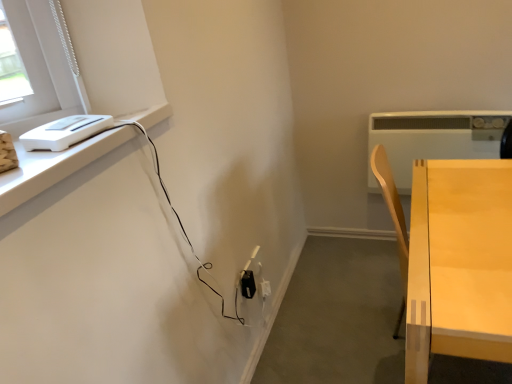
At what (x,y) coordinates should I click in order to perform the action: click on black plastic electric outlet at lower center. Please return your answer as a coordinate pair (x, y). The width and height of the screenshot is (512, 384). Looking at the image, I should click on (248, 284).

Locate an element on the screen. white plastic heater at upper right, the 1th appliance in the back-to-front sequence is located at coordinates (433, 138).

Where is `black plastic electric outlet at lower center`? The image size is (512, 384). black plastic electric outlet at lower center is located at coordinates (248, 284).

Is white plastic heater at upper right, the 1th appliance in the back-to-front sequence, positioned before white plastic toaster at upper left, which appears as the first appliance when viewed from the front?

No, it is not.

Considering the relative sizes of white plastic heater at upper right, the 2th appliance viewed from the front, and white plastic toaster at upper left, marked as the first appliance in a left-to-right arrangement, in the image provided, is white plastic heater at upper right, the 2th appliance viewed from the front, smaller than white plastic toaster at upper left, marked as the first appliance in a left-to-right arrangement,?

No.

Is white plastic heater at upper right, the 1th appliance in the back-to-front sequence, facing away from white plastic toaster at upper left, which ranks as the second appliance in right-to-left order?

No, white plastic heater at upper right, the 1th appliance in the back-to-front sequence, is not facing the opposite direction of white plastic toaster at upper left, which ranks as the second appliance in right-to-left order.

Considering the relative sizes of white plastic heater at upper right, the 2th appliance viewed from the front, and white plastic toaster at upper left, which appears as the first appliance when viewed from the front, in the image provided, is white plastic heater at upper right, the 2th appliance viewed from the front, thinner than white plastic toaster at upper left, which appears as the first appliance when viewed from the front,?

Yes, white plastic heater at upper right, the 2th appliance viewed from the front, is thinner than white plastic toaster at upper left, which appears as the first appliance when viewed from the front.

Is white plastic heater at upper right, the 1th appliance in the back-to-front sequence, turned away from black plastic electric outlet at lower center?

That's not correct — white plastic heater at upper right, the 1th appliance in the back-to-front sequence, is not looking away from black plastic electric outlet at lower center.

Which is in front, point (374, 113) or point (246, 272)?

The point (246, 272) is closer to the camera.

From the picture: Between white plastic heater at upper right, the 2th appliance viewed from the front, and black plastic electric outlet at lower center, which one has smaller width?

With smaller width is black plastic electric outlet at lower center.

Between white plastic heater at upper right, the 2th appliance viewed from the front, and black plastic electric outlet at lower center, which one appears on the left side from the viewer's perspective?

From the viewer's perspective, black plastic electric outlet at lower center appears more on the left side.

In the scene shown: Could you tell me if white plastic toaster at upper left, which appears as the first appliance when viewed from the front, is turned towards black plastic electric outlet at lower center?

No, white plastic toaster at upper left, which appears as the first appliance when viewed from the front, does not turn towards black plastic electric outlet at lower center.

From the image's perspective, who appears lower, white plastic toaster at upper left, which ranks as the second appliance in right-to-left order, or black plastic electric outlet at lower center?

From the image's view, black plastic electric outlet at lower center is below.

Which is behind, white plastic toaster at upper left, marked as the first appliance in a left-to-right arrangement, or black plastic electric outlet at lower center?

Positioned behind is black plastic electric outlet at lower center.

Can you confirm if white plastic toaster at upper left, marked as the first appliance in a left-to-right arrangement, is positioned to the right of black plastic electric outlet at lower center?

No.

Is white plastic heater at upper right, the 2th appliance viewed from the front, completely or partially inside white plastic toaster at upper left, marked as the first appliance in a left-to-right arrangement?

That's incorrect, white plastic heater at upper right, the 2th appliance viewed from the front, is not inside white plastic toaster at upper left, marked as the first appliance in a left-to-right arrangement.

From a real-world perspective, who is located lower, white plastic toaster at upper left, marked as the first appliance in a left-to-right arrangement, or white plastic heater at upper right, the 1th appliance in the back-to-front sequence?

From a 3D spatial view, white plastic heater at upper right, the 1th appliance in the back-to-front sequence, is below.

Visually, is white plastic toaster at upper left, marked as the first appliance in a left-to-right arrangement, positioned to the left or to the right of white plastic heater at upper right, the 1th appliance in the back-to-front sequence?

In the image, white plastic toaster at upper left, marked as the first appliance in a left-to-right arrangement, appears on the left side of white plastic heater at upper right, the 1th appliance in the back-to-front sequence.

Consider the image. Considering the relative positions of black plastic electric outlet at lower center and white plastic toaster at upper left, placed as the second appliance when sorted from back to front, in the image provided, is black plastic electric outlet at lower center to the right of white plastic toaster at upper left, placed as the second appliance when sorted from back to front, from the viewer's perspective?

Yes, black plastic electric outlet at lower center is to the right of white plastic toaster at upper left, placed as the second appliance when sorted from back to front.

Is point (252, 289) less distant than point (58, 145)?

No, it is not.

Which of these two, black plastic electric outlet at lower center or white plastic toaster at upper left, placed as the second appliance when sorted from back to front, is wider?

white plastic toaster at upper left, placed as the second appliance when sorted from back to front, is wider.

From the image's perspective, which object appears higher, black plastic electric outlet at lower center or white plastic toaster at upper left, which appears as the first appliance when viewed from the front?

white plastic toaster at upper left, which appears as the first appliance when viewed from the front, appears higher in the image.

Is white plastic toaster at upper left, placed as the second appliance when sorted from back to front, facing towards light wood table at right?

No, white plastic toaster at upper left, placed as the second appliance when sorted from back to front, does not turn towards light wood table at right.

In order to click on appliance that appears on the left of light wood table at right in this screenshot , I will do `click(64, 132)`.

From the image's perspective, which is above, white plastic toaster at upper left, placed as the second appliance when sorted from back to front, or light wood table at right?

white plastic toaster at upper left, placed as the second appliance when sorted from back to front, from the image's perspective.

Does point (64, 146) appear closer or farther from the camera than point (408, 341)?

Point (64, 146) is closer to the camera than point (408, 341).

Between point (441, 295) and point (58, 145), which one is positioned in front?

The point (58, 145) is closer to the camera.

From the image's perspective, is light wood table at right above or below white plastic toaster at upper left, which appears as the first appliance when viewed from the front?

Based on their image positions, light wood table at right is located beneath white plastic toaster at upper left, which appears as the first appliance when viewed from the front.

Which of these two, light wood table at right or white plastic toaster at upper left, placed as the second appliance when sorted from back to front, is bigger?

Bigger between the two is light wood table at right.

Is light wood table at right facing towards white plastic toaster at upper left, marked as the first appliance in a left-to-right arrangement?

No, light wood table at right is not turned towards white plastic toaster at upper left, marked as the first appliance in a left-to-right arrangement.

Where is `appliance above the white plastic heater at upper right, the 1th appliance in the back-to-front sequence (from a real-world perspective)`? The height and width of the screenshot is (384, 512). appliance above the white plastic heater at upper right, the 1th appliance in the back-to-front sequence (from a real-world perspective) is located at coordinates (64, 132).

The image size is (512, 384). I want to click on appliance that appears on the right of black plastic electric outlet at lower center, so click(x=433, y=138).

Looking at the image, which one is located closer to white plastic toaster at upper left, which ranks as the second appliance in right-to-left order, white plastic heater at upper right, the second appliance when ordered from left to right, or black plastic electric outlet at lower center?

black plastic electric outlet at lower center.

From the image, which object appears to be nearer to light wood table at right, white plastic heater at upper right, the second appliance when ordered from left to right, or black plastic electric outlet at lower center?

white plastic heater at upper right, the second appliance when ordered from left to right, is positioned closer to the anchor light wood table at right.

Looking at the image, which one is located further to white plastic toaster at upper left, which ranks as the second appliance in right-to-left order, white plastic heater at upper right, the 1th appliance when ordered from right to left, or light wood table at right?

white plastic heater at upper right, the 1th appliance when ordered from right to left.

Based on their spatial positions, is white plastic heater at upper right, the 1th appliance when ordered from right to left, or white plastic toaster at upper left, placed as the second appliance when sorted from back to front, closer to black plastic electric outlet at lower center?

The object closer to black plastic electric outlet at lower center is white plastic toaster at upper left, placed as the second appliance when sorted from back to front.

Estimate the real-world distances between objects in this image. Which object is further from white plastic toaster at upper left, which appears as the first appliance when viewed from the front, light wood table at right or white plastic heater at upper right, the 1th appliance in the back-to-front sequence?

white plastic heater at upper right, the 1th appliance in the back-to-front sequence.

Consider the image. Looking at the image, which one is located closer to white plastic heater at upper right, the 1th appliance in the back-to-front sequence, light wood table at right or black plastic electric outlet at lower center?

light wood table at right.

Based on their spatial positions, is white plastic toaster at upper left, placed as the second appliance when sorted from back to front, or black plastic electric outlet at lower center closer to white plastic heater at upper right, the 1th appliance when ordered from right to left?

black plastic electric outlet at lower center is positioned closer to the anchor white plastic heater at upper right, the 1th appliance when ordered from right to left.

When comparing their distances from white plastic heater at upper right, the 2th appliance viewed from the front, does light wood table at right or white plastic toaster at upper left, marked as the first appliance in a left-to-right arrangement, seem closer?

Based on the image, light wood table at right appears to be nearer to white plastic heater at upper right, the 2th appliance viewed from the front.

Identify the location of electric outlet between white plastic toaster at upper left, placed as the second appliance when sorted from back to front, and white plastic heater at upper right, the 1th appliance when ordered from right to left, from left to right. This screenshot has height=384, width=512. tap(248, 284).

This screenshot has height=384, width=512. In order to click on table located between white plastic toaster at upper left, marked as the first appliance in a left-to-right arrangement, and white plastic heater at upper right, the 2th appliance viewed from the front, in the left-right direction in this screenshot , I will do `click(459, 263)`.

Find the location of a particular element. electric outlet between light wood table at right and white plastic heater at upper right, the 1th appliance in the back-to-front sequence, in the front-back direction is located at coordinates (248, 284).

Identify the location of electric outlet between white plastic toaster at upper left, marked as the first appliance in a left-to-right arrangement, and light wood table at right, in the horizontal direction. (248, 284).